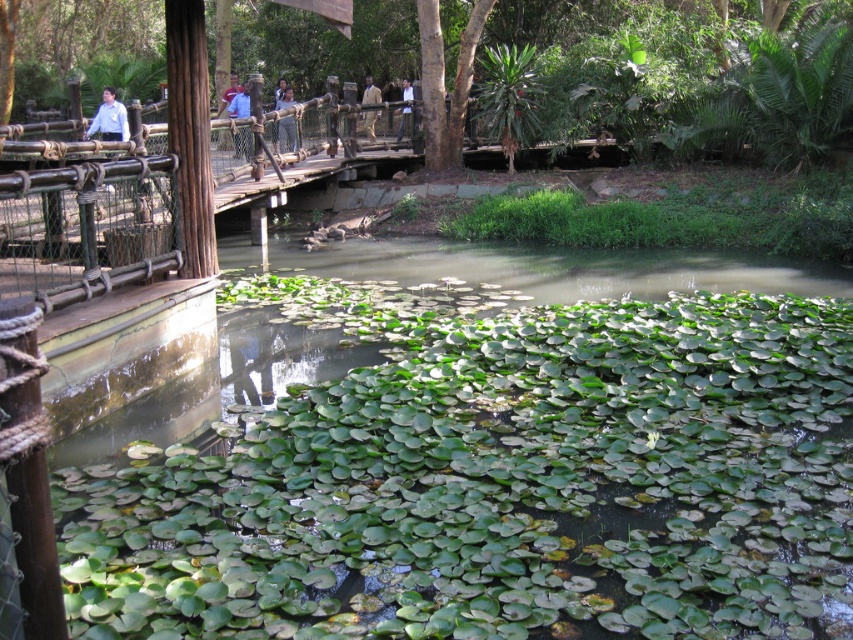
Is point (286, 132) behind point (222, 92)?

No, it is not.

The width and height of the screenshot is (853, 640). Describe the element at coordinates (286, 132) in the screenshot. I see `light blue shirt at center` at that location.

This screenshot has width=853, height=640. Identify the location of light blue shirt at center. (286, 132).

Does white shirt at upper left appear under blue fabric shirt at upper center?

Yes.

Is point (103, 140) farther from camera compared to point (228, 86)?

No, (103, 140) is closer to viewer.

The image size is (853, 640). Find the location of `white shirt at upper left`. white shirt at upper left is located at coordinates (109, 118).

Is light blue shirt at center to the left of light brown leather jacket at center from the viewer's perspective?

Indeed, light blue shirt at center is positioned on the left side of light brown leather jacket at center.

Between light blue shirt at center and light brown leather jacket at center, which one is positioned higher?

light brown leather jacket at center is higher up.

Between point (282, 97) and point (368, 92), which one is positioned in front?

Positioned in front is point (282, 97).

At what (x,y) coordinates should I click in order to perform the action: click on light blue shirt at center. Please return your answer as a coordinate pair (x, y). The width and height of the screenshot is (853, 640). Looking at the image, I should click on (286, 132).